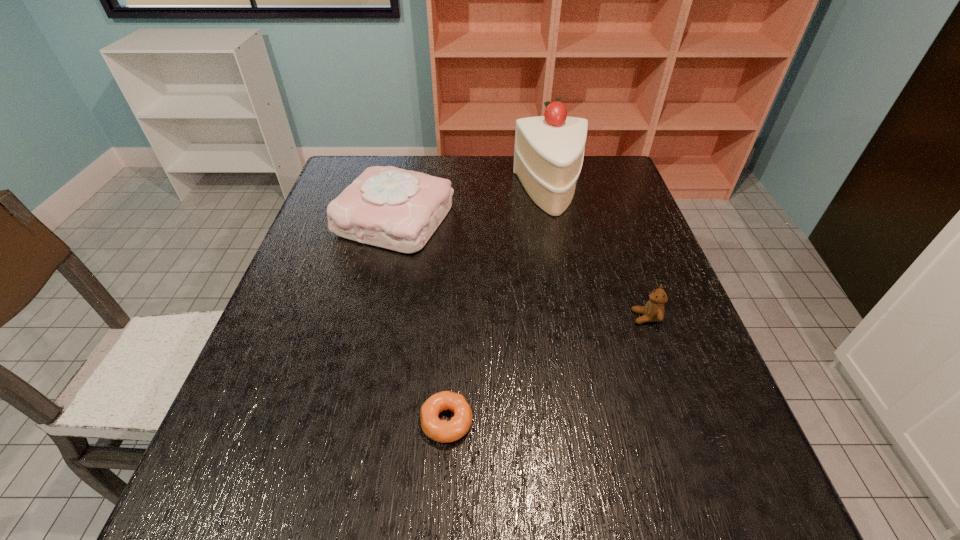
The width and height of the screenshot is (960, 540). Find the location of `vacant space located on the front-facing side of the teddy bear`. vacant space located on the front-facing side of the teddy bear is located at coordinates (495, 318).

Where is `vacant space located 0.150m on the front-facing side of the teddy bear`? The height and width of the screenshot is (540, 960). vacant space located 0.150m on the front-facing side of the teddy bear is located at coordinates (564, 318).

This screenshot has width=960, height=540. I want to click on free space located 0.110m on the front-facing side of the teddy bear, so (x=583, y=318).

Where is `vacant space located 0.100m on the front of the shortest object`? vacant space located 0.100m on the front of the shortest object is located at coordinates (442, 510).

Where is `object that is at the left edge`? This screenshot has width=960, height=540. object that is at the left edge is located at coordinates (388, 207).

Locate an element on the screen. Image resolution: width=960 pixels, height=540 pixels. cake present at the right edge is located at coordinates (548, 155).

Identify the location of teddy bear that is at the right edge. (653, 311).

Where is `object present at the far left corner`? object present at the far left corner is located at coordinates pyautogui.click(x=388, y=207).

The width and height of the screenshot is (960, 540). I want to click on object situated at the far right corner, so click(548, 155).

Where is `vacant space at the far edge of the desktop`? The image size is (960, 540). vacant space at the far edge of the desktop is located at coordinates (435, 172).